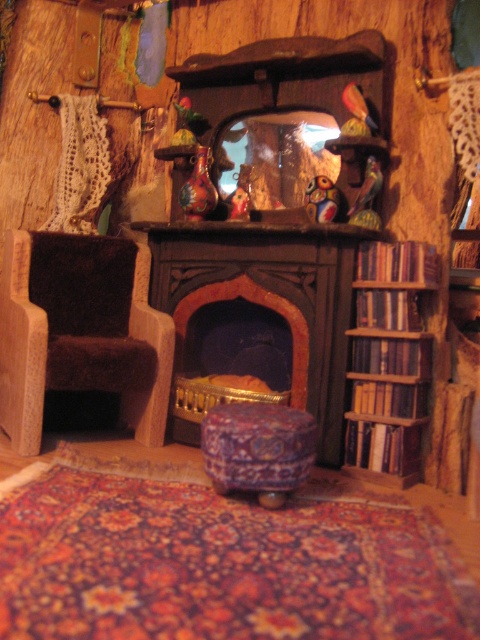
You are trying to place a new rug in the cozy, miniature room. The dark wood fireplace at center and the carpeted fabric stool at center are in the way. Which object should you move to make space for the rug?

The dark wood fireplace at center is positioned over the carpeted fabric stool at center, so you should move the dark wood fireplace at center to make space for the rug.

You are standing in the room and want to move from the carpeted fabric stool at center to the dark wood fireplace at center. Which direction should you move?

You should move to the left because the dark wood fireplace at center is to the right of the carpeted fabric stool at center, so moving left would bring you closer to it.

You are standing in the cozy, miniature room described. If you face the dark wood fireplace at center, which direction should you turn to see the small wooden chair with a dark cushioned seat and backrest located to the left of the fireplace?

You should turn to your left because the small wooden chair with a dark cushioned seat and backrest is positioned to the left of the dark wood fireplace at center.